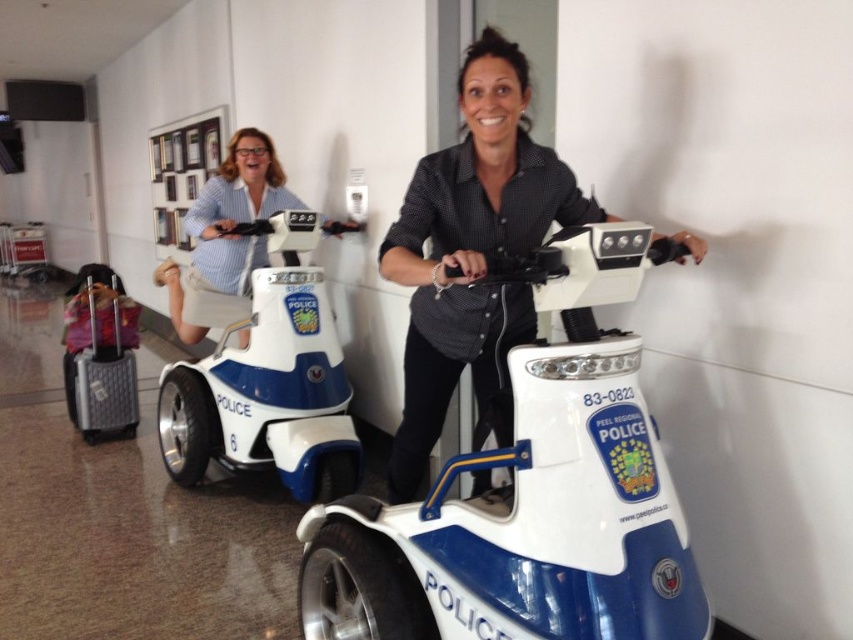
Question: From the image, what is the correct spatial relationship of matte black shirt at center in relation to blue glossy police scooter at upper left?

Choices:
 (A) above
 (B) below

Answer: (B)

Question: Which point is farther to the camera?

Choices:
 (A) (320, 369)
 (B) (254, 179)
 (C) (115, 282)

Answer: (C)

Question: Considering the relative positions of matte black shirt at center and blue glossy police scooter at upper left in the image provided, where is matte black shirt at center located with respect to blue glossy police scooter at upper left?

Choices:
 (A) right
 (B) left

Answer: (A)

Question: Which of the following is the closest to the observer?

Choices:
 (A) (84, 276)
 (B) (662, 600)
 (C) (178, 282)

Answer: (B)

Question: Is matte black shirt at center smaller than blue glossy police scooter at upper left?

Choices:
 (A) no
 (B) yes

Answer: (A)

Question: Which is farther from the white plastic scooter at left?

Choices:
 (A) blue glossy police scooter at upper left
 (B) gray fabric suitcase at lower left
 (C) white plastic mobility scooter at center
 (D) matte black shirt at center

Answer: (C)